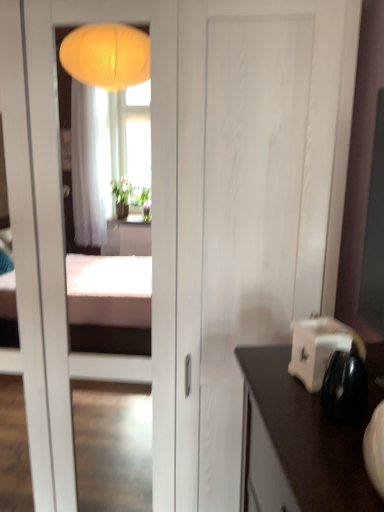
Question: Is white matte door at center to the right of white glossy toaster at right from the viewer's perspective?

Choices:
 (A) no
 (B) yes

Answer: (A)

Question: Are white matte door at center and white glossy toaster at right far apart?

Choices:
 (A) no
 (B) yes

Answer: (A)

Question: Is white matte door at center placed right next to white glossy toaster at right?

Choices:
 (A) yes
 (B) no

Answer: (B)

Question: Does white matte door at center have a lesser width compared to white glossy toaster at right?

Choices:
 (A) no
 (B) yes

Answer: (A)

Question: Is white matte door at center shorter than white glossy toaster at right?

Choices:
 (A) no
 (B) yes

Answer: (A)

Question: Considering the relative sizes of white matte door at center and white glossy toaster at right in the image provided, is white matte door at center smaller than white glossy toaster at right?

Choices:
 (A) no
 (B) yes

Answer: (A)

Question: Does white glossy toaster at right appear on the right side of white matte door at center?

Choices:
 (A) no
 (B) yes

Answer: (B)

Question: Can you confirm if white glossy toaster at right is shorter than white matte door at center?

Choices:
 (A) yes
 (B) no

Answer: (A)

Question: Is the surface of white glossy toaster at right in direct contact with white matte door at center?

Choices:
 (A) yes
 (B) no

Answer: (B)

Question: Is white glossy toaster at right smaller than white matte door at center?

Choices:
 (A) no
 (B) yes

Answer: (B)

Question: Does white glossy toaster at right have a larger size compared to white matte door at center?

Choices:
 (A) yes
 (B) no

Answer: (B)

Question: Is white glossy toaster at right located outside white matte door at center?

Choices:
 (A) no
 (B) yes

Answer: (B)

Question: Is white glossy toaster at right spatially inside white matte door at center, or outside of it?

Choices:
 (A) outside
 (B) inside

Answer: (A)